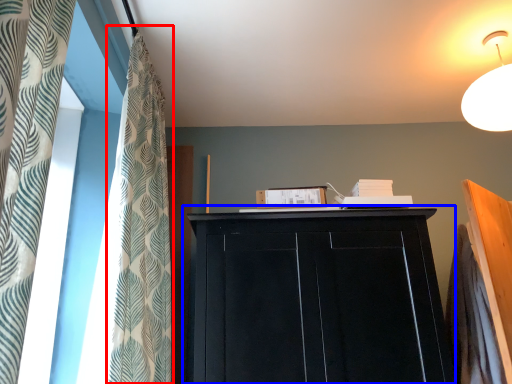
Question: Which of the following is the closest to the observer, shower curtain (highlighted by a red box) or cupboard (highlighted by a blue box)?

Choices:
 (A) shower curtain
 (B) cupboard

Answer: (A)